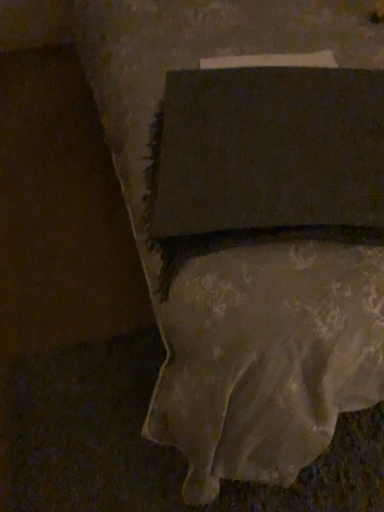
At what (x,y) coordinates should I click in order to perform the action: click on matte black pillow at center. Please return your answer as a coordinate pair (x, y). Looking at the image, I should click on (268, 150).

What do you see at coordinates (268, 150) in the screenshot?
I see `matte black pillow at center` at bounding box center [268, 150].

Identify the location of matte black pillow at center. (268, 150).